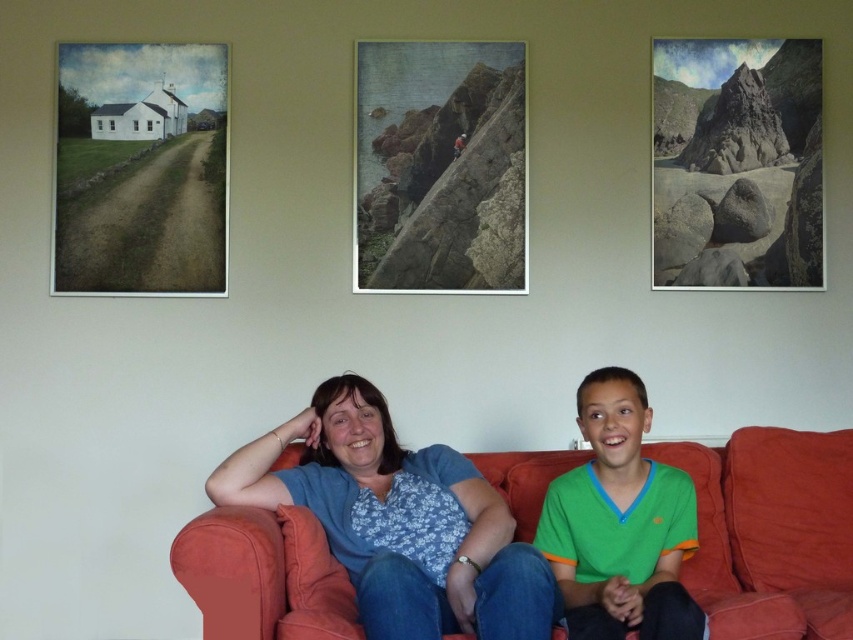
In the scene shown: You are an interior designer planning to place a new floor lamp next to the velvet orange couch at center. Considering the height of the rugged stone boulders at upper right, will the lamp need to be taller than the couch to avoid blocking the view of the boulders?

The velvet orange couch at center is shorter than rugged stone boulders at upper right, so placing a floor lamp taller than the couch would ensure the view of the rugged stone boulders at upper right remains unobstructed.

Consider the image. You are designing a new clothing catalog and need to place the blue floral shirt at center and green cotton shirt at lower right on a mannequin. Which shirt should be placed on the larger mannequin?

The blue floral shirt at center is larger than the green cotton shirt at lower right, so it should be placed on the larger mannequin.

You are a furniture designer who wants to place a new coffee table in front of the velvet orange couch at center. Considering the size of the green cotton shirt at lower right, can you estimate if the space between the couch and the wall is sufficient for a standard coffee table?

The velvet orange couch at center has a larger size compared to green cotton shirt at lower right. Since the green cotton shirt at lower right is part of the person on the right, the space between the couch and the wall is likely sufficient for a standard coffee table.